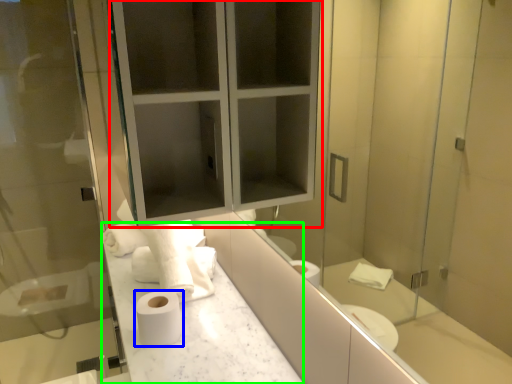
Question: Estimate the real-world distances between objects in this image. Which object is farther from medicine cabinet (highlighted by a red box), toilet paper (highlighted by a blue box) or counter top (highlighted by a green box)?

Choices:
 (A) toilet paper
 (B) counter top

Answer: (A)